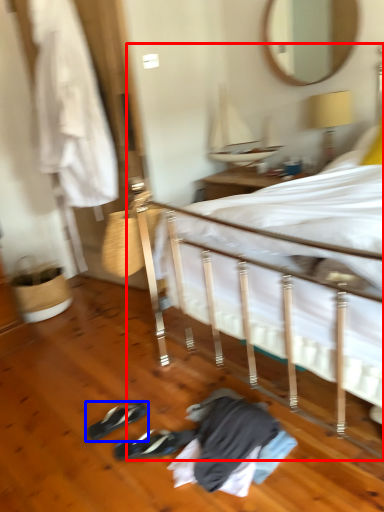
Question: Among these objects, which one is nearest to the camera, bed (highlighted by a red box) or footwear (highlighted by a blue box)?

Choices:
 (A) bed
 (B) footwear

Answer: (A)